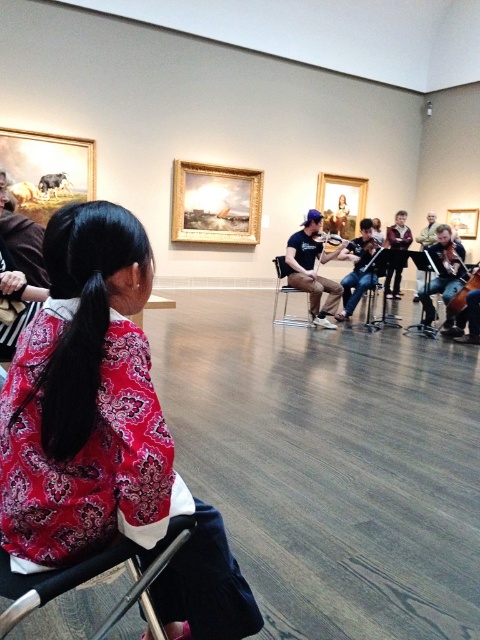
You are a photographer trying to capture a clear shot of both the shiny silver cello at center and the dark brown polished wood cello at right. Based on their positions, which cello will appear closer to the camera in your photo?

The shiny silver cello at center will appear closer to the camera because the dark brown polished wood cello at right is positioned behind it.